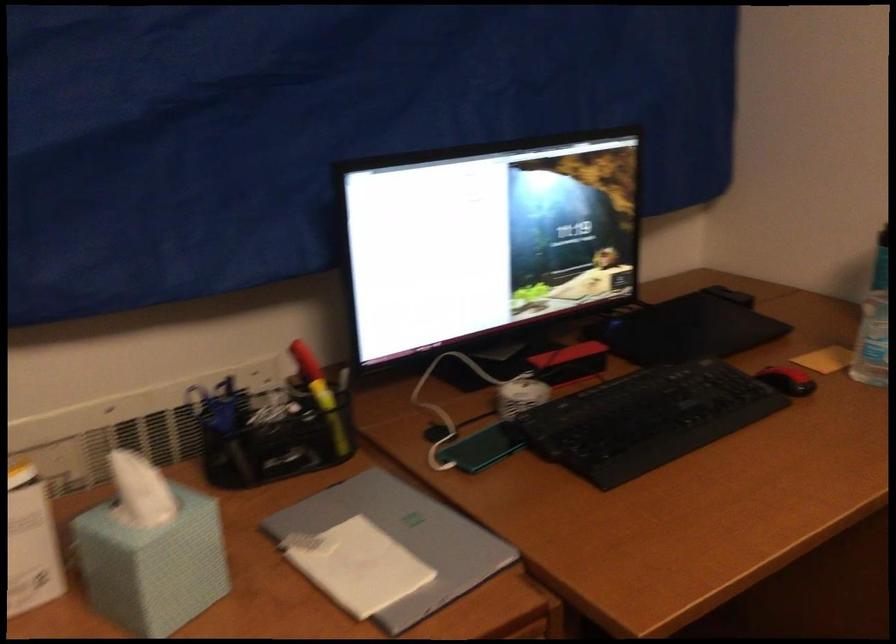
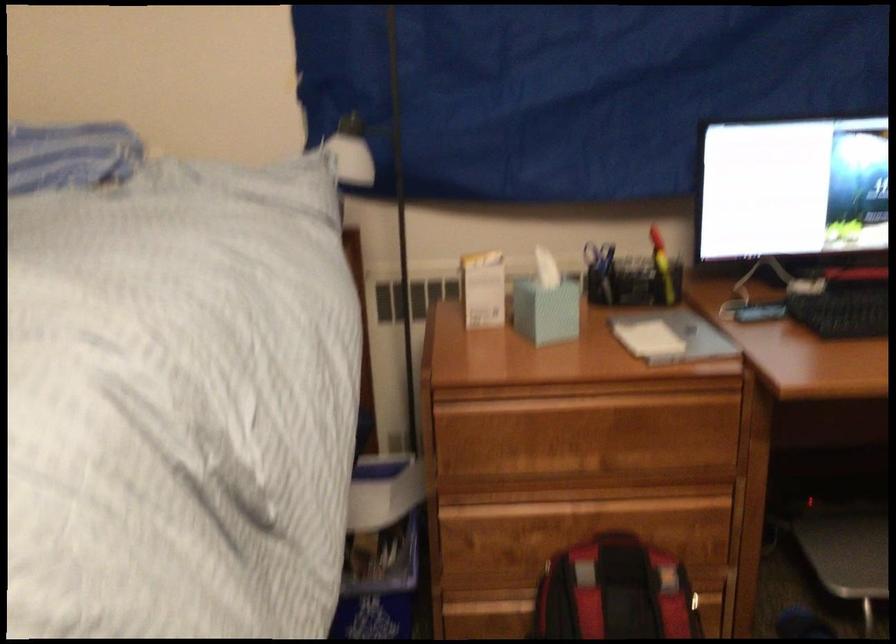
Where in the second image is the point corresponding to point (149, 498) from the first image?

(545, 270)